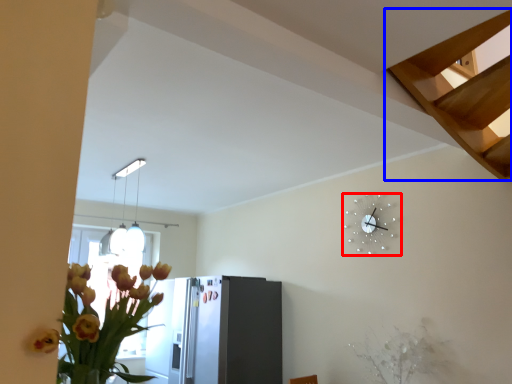
Question: Among these objects, which one is nearest to the camera, wall clock (highlighted by a red box) or stairs (highlighted by a blue box)?

Choices:
 (A) wall clock
 (B) stairs

Answer: (B)